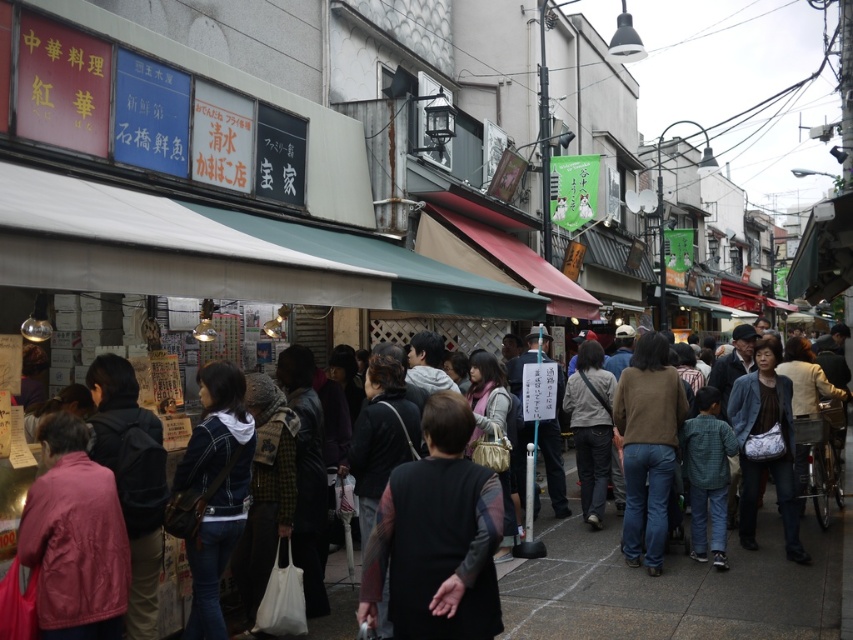
Between dark gray clothing at center and brown sweater at center, which one is positioned higher?

brown sweater at center

Describe the element at coordinates (672, 588) in the screenshot. This screenshot has height=640, width=853. I see `dark gray clothing at center` at that location.

At what (x,y) coordinates should I click in order to perform the action: click on dark gray clothing at center. Please return your answer as a coordinate pair (x, y). The image size is (853, 640). Looking at the image, I should click on (672, 588).

Is point (619, 561) in front of point (453, 499)?

No, (619, 561) is behind (453, 499).

In the scene shown: Does dark gray clothing at center appear over black fabric vest at center?

No, dark gray clothing at center is not above black fabric vest at center.

Is point (334, 627) more distant than point (460, 508)?

Yes, it is behind point (460, 508).

This screenshot has height=640, width=853. I want to click on dark gray clothing at center, so click(x=672, y=588).

Measure the distance between black fabric vest at center and camera.

The distance of black fabric vest at center from camera is 4.24 meters.

Is black fabric vest at center below brown sweater at center?

No, black fabric vest at center is not below brown sweater at center.

What do you see at coordinates (437, 536) in the screenshot? I see `black fabric vest at center` at bounding box center [437, 536].

Locate an element on the screen. black fabric vest at center is located at coordinates (437, 536).